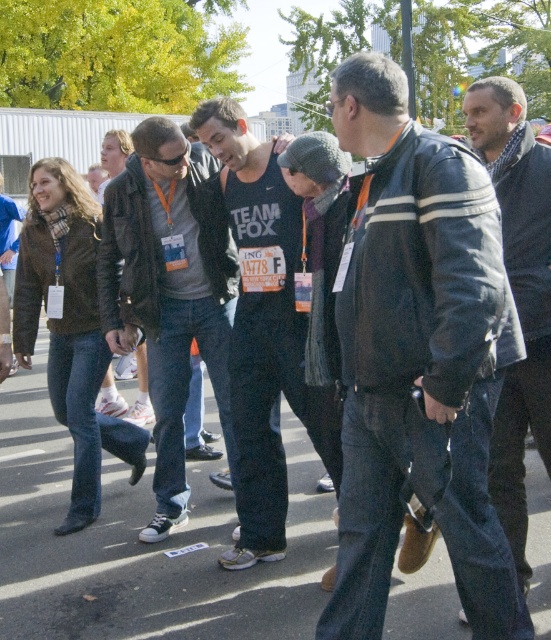
Question: Which of the following is the farthest from the observer?

Choices:
 (A) (376, 97)
 (B) (298, 364)
 (C) (218, 376)
 (D) (42, 204)

Answer: (D)

Question: Is the position of leather jacket at center more distant than that of dark gray jacket at center?

Choices:
 (A) no
 (B) yes

Answer: (A)

Question: Is matte black jacket at center smaller than dark gray jacket at center?

Choices:
 (A) no
 (B) yes

Answer: (B)

Question: Which point appears closest to the camera in this image?

Choices:
 (A) (375, 340)
 (B) (217, 308)

Answer: (A)

Question: Does matte brown jacket at left lie behind dark gray jacket at center?

Choices:
 (A) yes
 (B) no

Answer: (A)

Question: Which point is closer to the camera?

Choices:
 (A) (220, 116)
 (B) (217, 300)

Answer: (A)